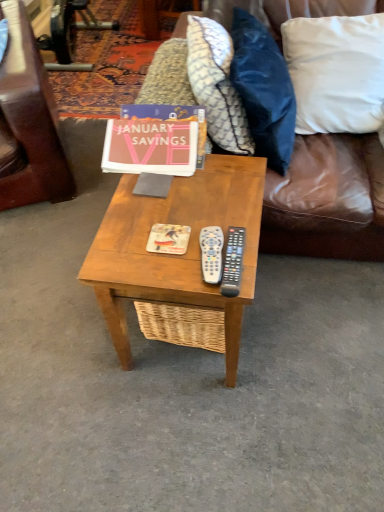
Question: Can you confirm if brown leather couch at upper right is shorter than white cotton pillow at upper right, the first pillow viewed from the right?

Choices:
 (A) no
 (B) yes

Answer: (A)

Question: Is brown leather couch at upper right looking in the opposite direction of white cotton pillow at upper right, the first pillow viewed from the right?

Choices:
 (A) no
 (B) yes

Answer: (B)

Question: Considering the relative sizes of brown leather couch at upper right and white cotton pillow at upper right, the first pillow viewed from the right, in the image provided, is brown leather couch at upper right taller than white cotton pillow at upper right, the first pillow viewed from the right,?

Choices:
 (A) yes
 (B) no

Answer: (A)

Question: From the image's perspective, is brown leather couch at upper right under white cotton pillow at upper right, the first pillow viewed from the right?

Choices:
 (A) yes
 (B) no

Answer: (A)

Question: Does brown leather couch at upper right have a lesser width compared to white cotton pillow at upper right, acting as the third pillow starting from the left?

Choices:
 (A) yes
 (B) no

Answer: (B)

Question: From the image's perspective, is white fabric pillow at upper right, the 2th pillow from the left, above or below black plastic remote at right, which appears as the 2th remote when viewed from the left?

Choices:
 (A) above
 (B) below

Answer: (A)

Question: From their relative heights in the image, would you say white fabric pillow at upper right, which appears as the second pillow when viewed from the right, is taller or shorter than black plastic remote at right, marked as the first remote in a right-to-left arrangement?

Choices:
 (A) short
 (B) tall

Answer: (B)

Question: Considering the positions of white fabric pillow at upper right, the 2th pillow from the left, and black plastic remote at right, marked as the first remote in a right-to-left arrangement, in the image, is white fabric pillow at upper right, the 2th pillow from the left, wider or thinner than black plastic remote at right, marked as the first remote in a right-to-left arrangement,?

Choices:
 (A) wide
 (B) thin

Answer: (B)

Question: Relative to black plastic remote at right, which appears as the 2th remote when viewed from the left, is white fabric pillow at upper right, the 2th pillow from the left, in front or behind?

Choices:
 (A) behind
 (B) front

Answer: (A)

Question: Is white cotton pillow at upper right, the first pillow viewed from the right, situated inside matte orange magazine at center or outside?

Choices:
 (A) inside
 (B) outside

Answer: (B)

Question: Considering the positions of white cotton pillow at upper right, the first pillow viewed from the right, and matte orange magazine at center in the image, is white cotton pillow at upper right, the first pillow viewed from the right, wider or thinner than matte orange magazine at center?

Choices:
 (A) wide
 (B) thin

Answer: (A)

Question: Is point (332, 95) closer or farther from the camera than point (175, 230)?

Choices:
 (A) farther
 (B) closer

Answer: (A)

Question: Would you say white cotton pillow at upper right, acting as the third pillow starting from the left, is to the left or to the right of matte orange magazine at center in the picture?

Choices:
 (A) right
 (B) left

Answer: (A)

Question: Looking at their shapes, would you say white plastic remote at center, marked as the second remote in a right-to-left arrangement, is wider or thinner than brown leather couch at upper right?

Choices:
 (A) wide
 (B) thin

Answer: (B)

Question: Looking at the image, does white plastic remote at center, which is the first remote from left to right, seem bigger or smaller compared to brown leather couch at upper right?

Choices:
 (A) small
 (B) big

Answer: (A)